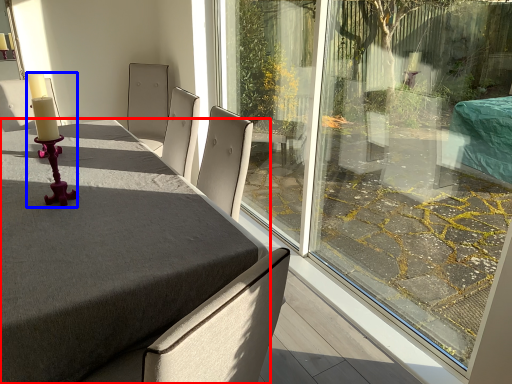
Question: Which object appears closest to the camera in this image, table (highlighted by a red box) or candle holder (highlighted by a blue box)?

Choices:
 (A) table
 (B) candle holder

Answer: (A)